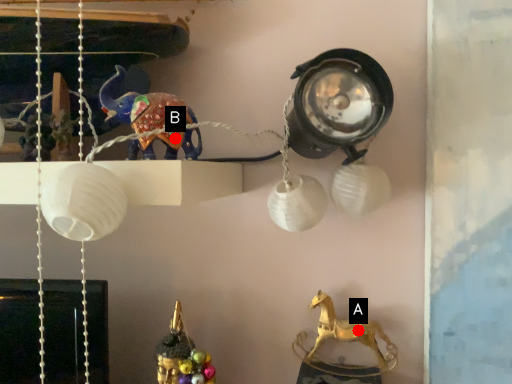
Question: Two points are circled on the image, labeled by A and B beside each circle. Which point appears farthest from the camera in this image?

Choices:
 (A) A is further
 (B) B is further

Answer: (A)